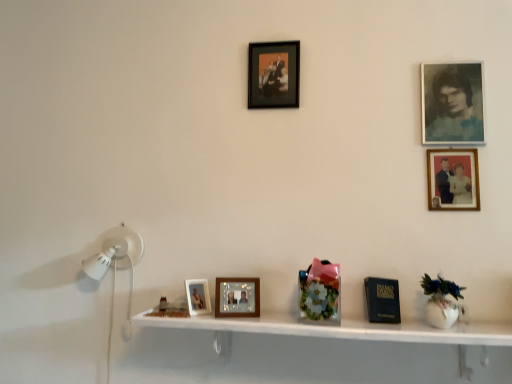
Question: Is matte wooden picture frame at center, which is the 5th picture frame in right-to-left order, oriented away from floral-patterned glass vase at center?

Choices:
 (A) yes
 (B) no

Answer: (B)

Question: Considering the relative sizes of matte wooden picture frame at center, placed as the first picture frame when sorted from left to right, and floral-patterned glass vase at center in the image provided, is matte wooden picture frame at center, placed as the first picture frame when sorted from left to right, wider than floral-patterned glass vase at center?

Choices:
 (A) yes
 (B) no

Answer: (B)

Question: From a real-world perspective, is matte wooden picture frame at center, which is the 5th picture frame in right-to-left order, positioned under floral-patterned glass vase at center based on gravity?

Choices:
 (A) no
 (B) yes

Answer: (B)

Question: Is matte wooden picture frame at center, which is the 5th picture frame in right-to-left order, further to the viewer compared to floral-patterned glass vase at center?

Choices:
 (A) yes
 (B) no

Answer: (A)

Question: Is matte wooden picture frame at center, placed as the first picture frame when sorted from left to right, thinner than floral-patterned glass vase at center?

Choices:
 (A) no
 (B) yes

Answer: (B)

Question: From a real-world perspective, relative to wooden picture frame at upper right, marked as the third picture frame in a bottom-to-top arrangement, is matte black picture frame at upper center, marked as the first picture frame in a top-to-bottom arrangement, vertically above or below?

Choices:
 (A) below
 (B) above

Answer: (B)

Question: Is matte black picture frame at upper center, the 3th picture frame when ordered from left to right, to the left or to the right of wooden picture frame at upper right, the third picture frame from the top, in the image?

Choices:
 (A) left
 (B) right

Answer: (A)

Question: In terms of size, does matte black picture frame at upper center, arranged as the fifth picture frame when ordered from the bottom, appear bigger or smaller than wooden picture frame at upper right, which appears as the fourth picture frame when viewed from the left?

Choices:
 (A) small
 (B) big

Answer: (B)

Question: Would you say matte black picture frame at upper center, the 3th picture frame in the right-to-left sequence, is inside or outside wooden picture frame at upper right, which appears as the fourth picture frame when viewed from the left?

Choices:
 (A) outside
 (B) inside

Answer: (A)

Question: From the image's perspective, is matte black picture frame at upper center, the 3th picture frame when ordered from left to right, above or below matte wooden picture frame at center, the 1th picture frame positioned from the bottom?

Choices:
 (A) below
 (B) above

Answer: (B)

Question: In terms of height, does matte black picture frame at upper center, the 3th picture frame when ordered from left to right, look taller or shorter compared to matte wooden picture frame at center, the fifth picture frame when ordered from top to bottom?

Choices:
 (A) short
 (B) tall

Answer: (B)

Question: Looking at the image, does matte black picture frame at upper center, the 3th picture frame in the right-to-left sequence, seem bigger or smaller compared to matte wooden picture frame at center, the fifth picture frame when ordered from top to bottom?

Choices:
 (A) small
 (B) big

Answer: (B)

Question: Is matte black picture frame at upper center, arranged as the fifth picture frame when ordered from the bottom, to the left or to the right of matte wooden picture frame at center, placed as the first picture frame when sorted from left to right, in the image?

Choices:
 (A) left
 (B) right

Answer: (B)

Question: In terms of size, does matte wooden picture frame at center, the 1th picture frame positioned from the bottom, appear bigger or smaller than blue-toned paper photo frame at upper right, which ranks as the fifth picture frame in left-to-right order?

Choices:
 (A) big
 (B) small

Answer: (B)

Question: Considering their positions, is matte wooden picture frame at center, placed as the first picture frame when sorted from left to right, located in front of or behind blue-toned paper photo frame at upper right, the fourth picture frame in the bottom-to-top sequence?

Choices:
 (A) front
 (B) behind

Answer: (A)